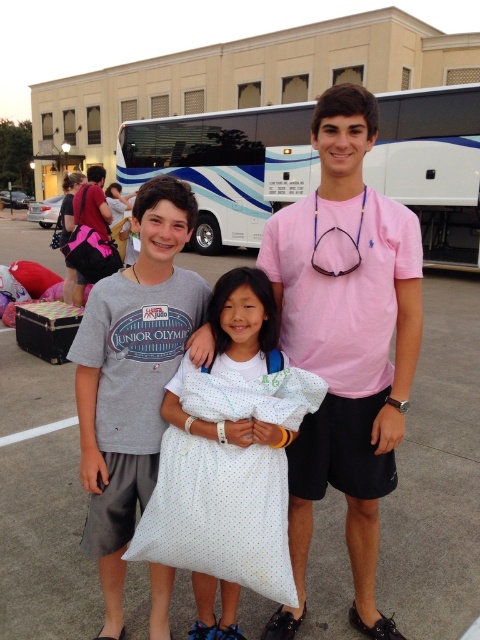
Based on the coordinates provided, which object is located at point (133,376)?

The point (133,376) marks the location of the gray cotton t shirt at center.